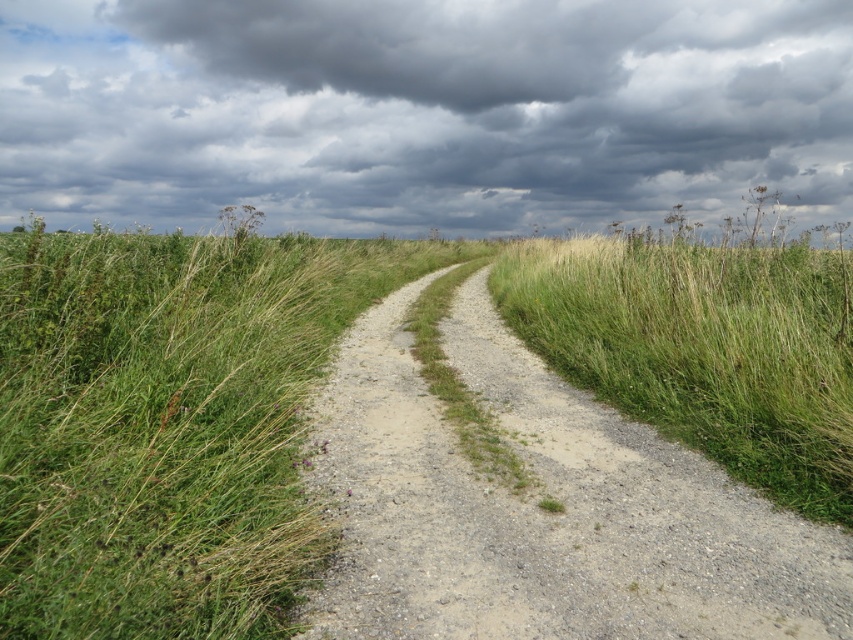
Can you confirm if dark gray cloud at upper center is shorter than dusty gravel path at center?

In fact, dark gray cloud at upper center may be taller than dusty gravel path at center.

Is dark gray cloud at upper center below dusty gravel path at center?

No.

Measure the distance between point (727, 116) and camera.

Point (727, 116) and camera are 45.01 meters apart.

This screenshot has height=640, width=853. What are the coordinates of `dark gray cloud at upper center` in the screenshot? It's located at (422, 112).